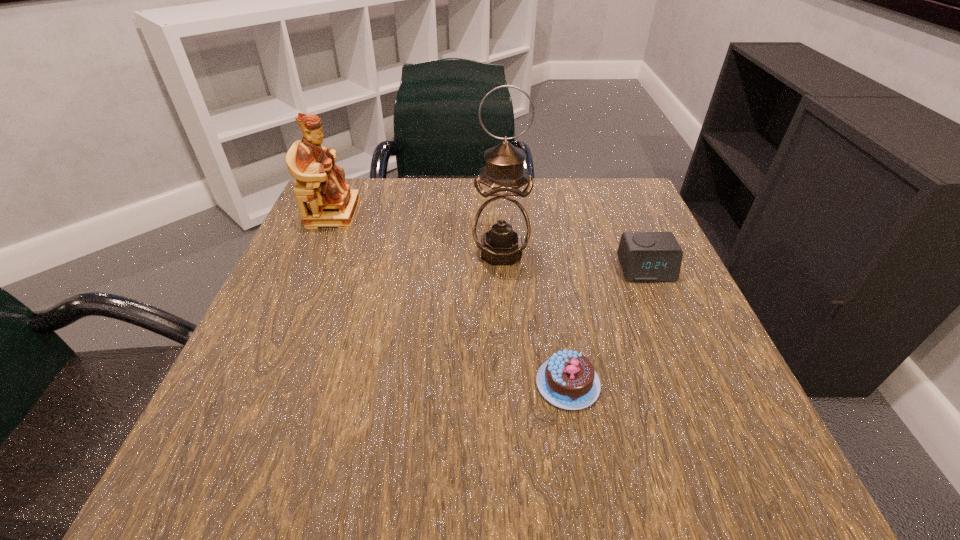
Identify the location of oil lamp. This screenshot has width=960, height=540. click(x=501, y=229).

At what (x,y) coordinates should I click in order to perform the action: click on the leftmost object. Please return your answer as a coordinate pair (x, y). Looking at the image, I should click on (332, 203).

This screenshot has width=960, height=540. Find the location of `the second tallest object`. the second tallest object is located at coordinates (332, 203).

This screenshot has width=960, height=540. I want to click on the third tallest object, so click(644, 256).

Locate an element on the screen. This screenshot has height=540, width=960. the rightmost object is located at coordinates (644, 256).

Where is `chocolate cake`? The width and height of the screenshot is (960, 540). chocolate cake is located at coordinates (568, 380).

You are a GUI agent. You are given a task and a screenshot of the screen. Output one action in this format:
    pyautogui.click(x=<x>, y=<y>)
    Task: Click on the shortest object
    
    Given the screenshot: What is the action you would take?
    pyautogui.click(x=568, y=380)

The height and width of the screenshot is (540, 960). I want to click on vacant region located on the front of the oil lamp, so click(x=508, y=371).

In order to click on vacant space located on the front-facing side of the leftmost object in this screenshot , I will do `click(444, 213)`.

At what (x,y) coordinates should I click in order to perform the action: click on vacant area situated on the front-facing side of the alarm clock. Please return your answer as a coordinate pair (x, y). This screenshot has width=960, height=540. Looking at the image, I should click on (708, 417).